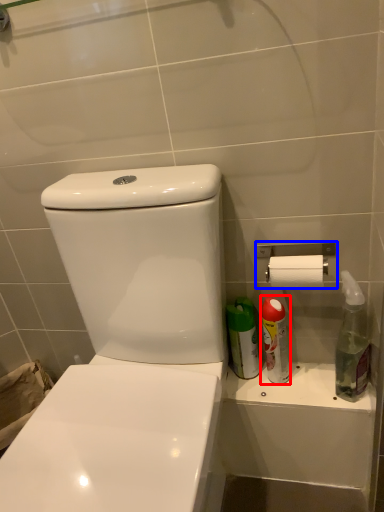
Question: Which object appears closest to the camera in this image, cleaning product (highlighted by a red box) or towel bar (highlighted by a blue box)?

Choices:
 (A) cleaning product
 (B) towel bar

Answer: (B)